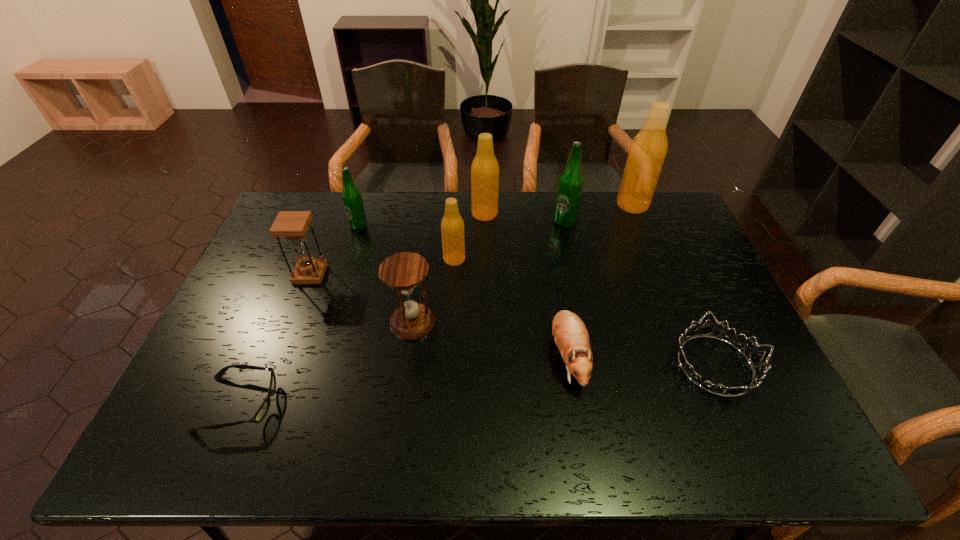
Locate an element on the screen. The width and height of the screenshot is (960, 540). the rightmost tan beer bottle is located at coordinates (648, 150).

In order to click on the tallest beer bottle in this screenshot , I will do `click(648, 150)`.

Locate an element on the screen. the third beer bottle from right to left is located at coordinates (485, 169).

At what (x,y) coordinates should I click in order to perform the action: click on the second tan beer bottle from right to left. Please return your answer as a coordinate pair (x, y). Image resolution: width=960 pixels, height=540 pixels. Looking at the image, I should click on (485, 169).

Locate an element on the screen. the bigger green beer bottle is located at coordinates 570,185.

This screenshot has width=960, height=540. Identify the location of the right green beer bottle. (570, 185).

This screenshot has height=540, width=960. What are the coordinates of `the third object from left to right` in the screenshot? It's located at (352, 200).

At what (x,y) coordinates should I click in order to perform the action: click on the leftmost beer bottle. Please return your answer as a coordinate pair (x, y). The height and width of the screenshot is (540, 960). Looking at the image, I should click on (352, 200).

This screenshot has width=960, height=540. In order to click on the smallest tan beer bottle in this screenshot , I will do `click(452, 225)`.

This screenshot has height=540, width=960. Identify the location of the sixth object from right to left. (452, 225).